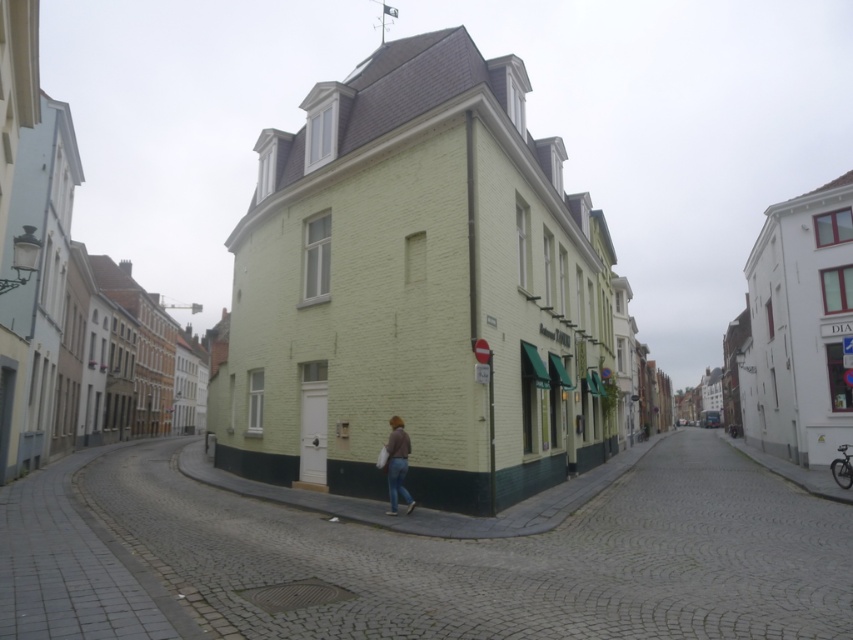
You are a delivery person with a cart that is 1 meter wide. You need to navigate through the smooth cobblestone alley at center while avoiding the denim pants at center. Is your cart wide enough to pass through the alley without touching the denim pants?

The smooth cobblestone alley at center is wider than the denim pants at center. Since the alley is wider than the cart, the cart can pass through without touching the denim pants.

You are a delivery person standing at the corner of the smooth cobblestone alley at center and the denim pants at center. You need to place a package on the ground. Which surface should you choose to ensure the package stays above the ground level?

The smooth cobblestone alley at center is taller than the denim pants at center, so placing the package on the smooth cobblestone alley at center will keep it above ground level.

You are standing on the sidewalk in this urban scene. You see the smooth cobblestone alley at center and the denim pants at center. Which object is located to the right of the other?

The smooth cobblestone alley at center is to the left of denim pants at center, so the denim pants at center is to the right of the smooth cobblestone alley at center.